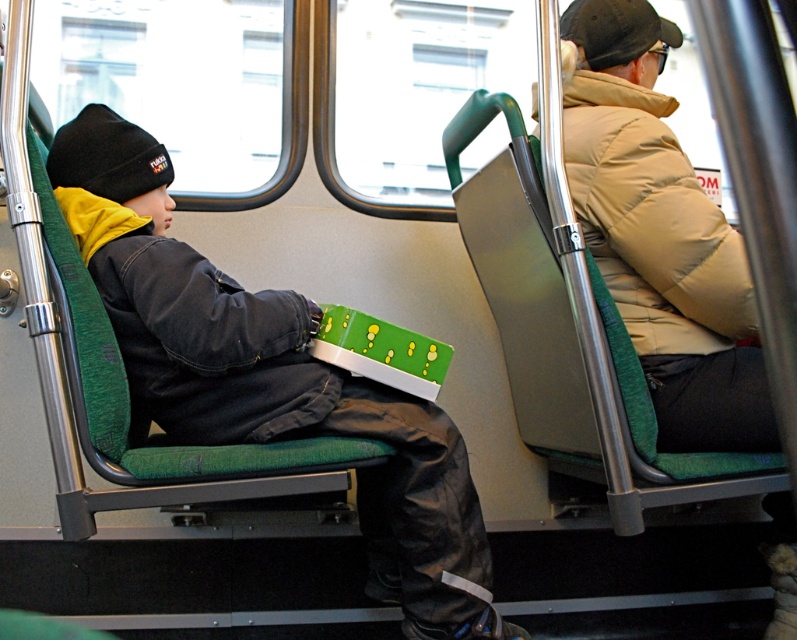
Based on the photo, you are a passenger on a bus and you see the matte black beanie at left and the beige puffy jacket at upper right. Which object is taller?

The matte black beanie at left is taller than the beige puffy jacket at upper right.

You are a passenger on the bus and you see two points marked in the scene. The first point is at coordinate point (x=57, y=176) and the second point is at coordinate point (x=646, y=16). Which point is closer to you?

Point (x=57, y=176) is closer to the camera than point (x=646, y=16).